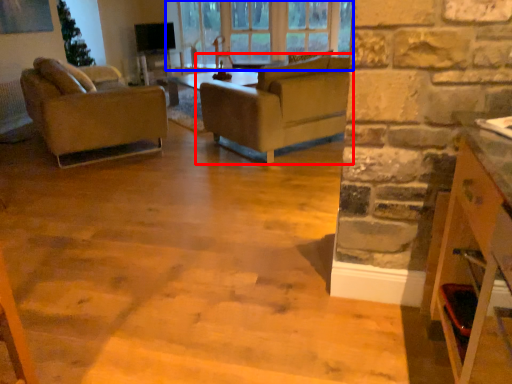
Question: Which object is further to the camera taking this photo, studio couch (highlighted by a red box) or window (highlighted by a blue box)?

Choices:
 (A) studio couch
 (B) window

Answer: (B)